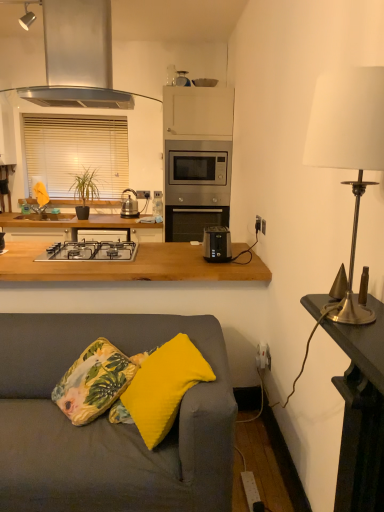
Describe the element at coordinates (129, 205) in the screenshot. This screenshot has width=384, height=512. I see `satin black kettle at center, the second appliance ordered from the bottom` at that location.

Measure the distance between black plastic toaster at center and camera.

A distance of 7.87 feet exists between black plastic toaster at center and camera.

This screenshot has width=384, height=512. What do you see at coordinates (78, 58) in the screenshot? I see `satin silver range hood at upper center` at bounding box center [78, 58].

Image resolution: width=384 pixels, height=512 pixels. In order to click on satin silver microwave at upper center, the 2th appliance when ordered from right to left in this screenshot , I will do `click(182, 79)`.

Image resolution: width=384 pixels, height=512 pixels. In order to click on stainless steel gas stove at center in this screenshot , I will do `click(90, 251)`.

Find the location of a particular element. polished brass table lamp at right is located at coordinates (348, 144).

How different are the orientations of stainless steel microwave at center and white blinds at upper left in degrees?

The angle between the facing direction of stainless steel microwave at center and the facing direction of white blinds at upper left is 0.00147 degrees.

Considering the sizes of objects stainless steel microwave at center and white blinds at upper left in the image provided, who is taller, stainless steel microwave at center or white blinds at upper left?

white blinds at upper left is taller.

From the image's perspective, which one is positioned higher, stainless steel microwave at center or white blinds at upper left?

white blinds at upper left.

Is stainless steel microwave at center wider than white blinds at upper left?

Yes, stainless steel microwave at center is wider than white blinds at upper left.

Is point (213, 233) farther from viewer compared to point (69, 124)?

That is False.

Looking at this image, from the image's perspective, is black plastic toaster at center located above or below white blinds at upper left?

black plastic toaster at center is situated lower than white blinds at upper left in the image.

Considering the positions of objects black plastic toaster at center and white blinds at upper left in the image provided, who is behind, black plastic toaster at center or white blinds at upper left?

white blinds at upper left is behind.

Does green matte plant at left come behind yellow fabric pillow at lower center, the 2th pillow viewed from the front?

Yes, green matte plant at left is further from the viewer.

How distant is green matte plant at left from yellow fabric pillow at lower center, which is counted as the first pillow, starting from the back?

A distance of 9.48 feet exists between green matte plant at left and yellow fabric pillow at lower center, which is counted as the first pillow, starting from the back.

From the image's perspective, which one is positioned lower, green matte plant at left or yellow fabric pillow at lower center, the 2th pillow viewed from the front?

yellow fabric pillow at lower center, the 2th pillow viewed from the front, is shown below in the image.

Considering the sizes of objects black plastic toaster at center and polished brass table lamp at right in the image provided, who is wider, black plastic toaster at center or polished brass table lamp at right?

Wider between the two is polished brass table lamp at right.

Is point (209, 236) behind point (321, 163)?

Yes, it is.

From a real-world perspective, is black plastic toaster at center physically below polished brass table lamp at right?

Yes, from a real-world perspective, black plastic toaster at center is under polished brass table lamp at right.

From a real-world perspective, relative to white blinds at upper left, is satin black kettle at center, which is counted as the third appliance, starting from the right, vertically above or below?

Clearly, from a real-world perspective, satin black kettle at center, which is counted as the third appliance, starting from the right, is below white blinds at upper left.

Is the position of satin black kettle at center, which is counted as the third appliance, starting from the right, less distant than that of white blinds at upper left?

That is True.

Which appliance is the 1st one when counting from the right side of the white blinds at upper left? Please provide its 2D coordinates.

[(129, 205)]

Looking at this image, can you confirm if satin black kettle at center, which is counted as the 3th appliance, starting from the front, is positioned to the left of white blinds at upper left?

Incorrect, satin black kettle at center, which is counted as the 3th appliance, starting from the front, is not on the left side of white blinds at upper left.

From a real-world perspective, who is located higher, yellow fabric pillow at lower left, which is the second pillow from back to front, or green matte plant at left?

In real-world perspective, green matte plant at left is above.

From the image's perspective, which object appears higher, yellow fabric pillow at lower left, the 1th pillow when ordered from front to back, or green matte plant at left?

From the image's view, green matte plant at left is above.

Which is closer, (173, 417) or (69, 189)?

Positioned in front is point (173, 417).

Starting from the green matte plant at left, which pillow is the 2nd one in front? Please provide its 2D coordinates.

[(164, 387)]

From a real-world perspective, who is located higher, white blinds at upper left or gold metallic lamp at right, positioned as the 1th appliance in right-to-left order?

From a 3D spatial view, white blinds at upper left is above.

Can you confirm if white blinds at upper left is positioned to the left of gold metallic lamp at right, the 3th appliance from the back?

Indeed, white blinds at upper left is positioned on the left side of gold metallic lamp at right, the 3th appliance from the back.

Considering the relative sizes of white blinds at upper left and gold metallic lamp at right, the 3th appliance from the top, in the image provided, is white blinds at upper left thinner than gold metallic lamp at right, the 3th appliance from the top,?

No, white blinds at upper left is not thinner than gold metallic lamp at right, the 3th appliance from the top.

Is white blinds at upper left facing towards gold metallic lamp at right, the 3th appliance from the top?

Yes, white blinds at upper left is turned towards gold metallic lamp at right, the 3th appliance from the top.

Identify the location of window screen above the stainless steel microwave at center (from a real-world perspective). (76, 151).

The image size is (384, 512). I want to click on toaster in front of the white blinds at upper left, so click(217, 244).

Which object lies nearer to the anchor point green matte plant at left, stainless steel microwave at center or satin silver microwave at upper center, placed as the 2th appliance when sorted from front to back?

stainless steel microwave at center lies closer to green matte plant at left than the other object.

Considering their positions, is gold metallic lamp at right, the first appliance in the bottom-to-top sequence, positioned closer to stainless steel gas stove at center than white plastic electric outlet at right?

Among the two, white plastic electric outlet at right is located nearer to stainless steel gas stove at center.

Looking at this image, estimate the real-world distances between objects in this image. Which object is closer to gold metallic table at right, satin silver microwave at upper center, the 2th appliance viewed from the back, or yellow fabric pillow at lower center, which is counted as the first pillow, starting from the back?

yellow fabric pillow at lower center, which is counted as the first pillow, starting from the back.

Looking at the image, which one is located further to satin silver range hood at upper center, satin black kettle at center, the second appliance ordered from the bottom, or stainless steel gas stove at center?

satin black kettle at center, the second appliance ordered from the bottom, lies further to satin silver range hood at upper center than the other object.

When comparing their distances from stainless steel cabinet at upper center, does yellow fabric pillow at lower center, the 2th pillow viewed from the front, or gold metallic table at right seem further?

gold metallic table at right lies further to stainless steel cabinet at upper center than the other object.

Based on their spatial positions, is gold metallic lamp at right, the 3th appliance when ordered from left to right, or green matte plant at left further from gold metallic table at right?

Among the two, green matte plant at left is located further to gold metallic table at right.

Looking at the image, which one is located closer to satin silver microwave at upper center, positioned as the first appliance in top-to-bottom order, yellow fabric pillow at lower center, which is counted as the first pillow, starting from the back, or black plastic toaster at center?

The object closer to satin silver microwave at upper center, positioned as the first appliance in top-to-bottom order, is black plastic toaster at center.

Which object lies further to the anchor point white blinds at upper left, black plastic toaster at center or green matte plant at left?

The object further to white blinds at upper left is black plastic toaster at center.

This screenshot has height=512, width=384. Find the location of `oven between satin silver microwave at upper center, the 2th appliance viewed from the back, and satin black kettle at center, the second appliance from the top, vertically`. oven between satin silver microwave at upper center, the 2th appliance viewed from the back, and satin black kettle at center, the second appliance from the top, vertically is located at coordinates (198, 172).

Identify the location of appliance located between floral fabric throw pillow at lower left and satin black kettle at center, the second appliance from the top, in the depth direction. This screenshot has width=384, height=512. (182, 79).

Image resolution: width=384 pixels, height=512 pixels. Find the location of `houseplant between white plastic electric outlet at right and white blinds at upper left from front to back`. houseplant between white plastic electric outlet at right and white blinds at upper left from front to back is located at coordinates (84, 192).

Identify the location of kitchen appliance located between yellow fabric pillow at lower left, which is the second pillow from back to front, and stainless steel cabinet at upper center in the depth direction. (78, 58).